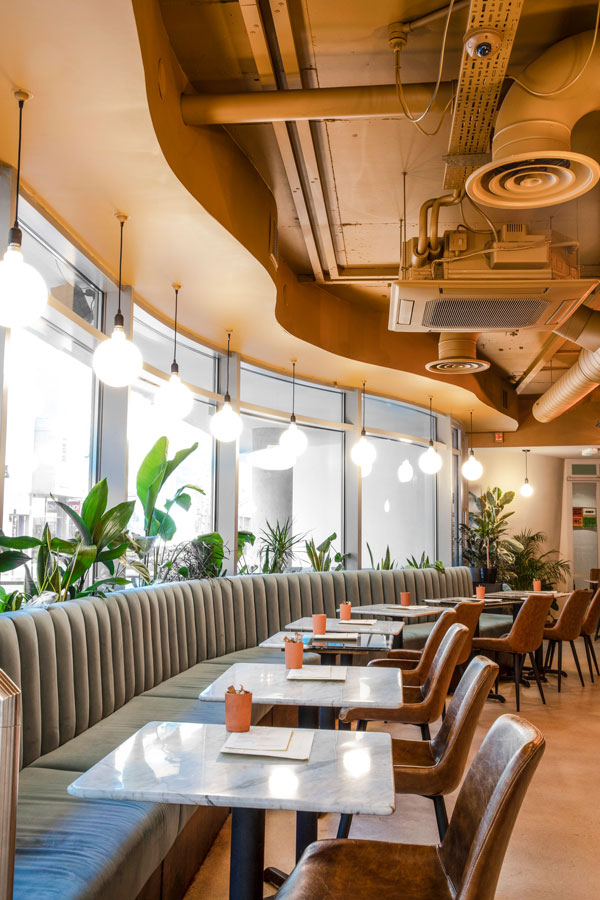
Locate an element on the screen. Image resolution: width=600 pixels, height=900 pixels. orange table centerpieces is located at coordinates (239, 711), (291, 652), (318, 624), (344, 609), (402, 598), (480, 591), (538, 585).